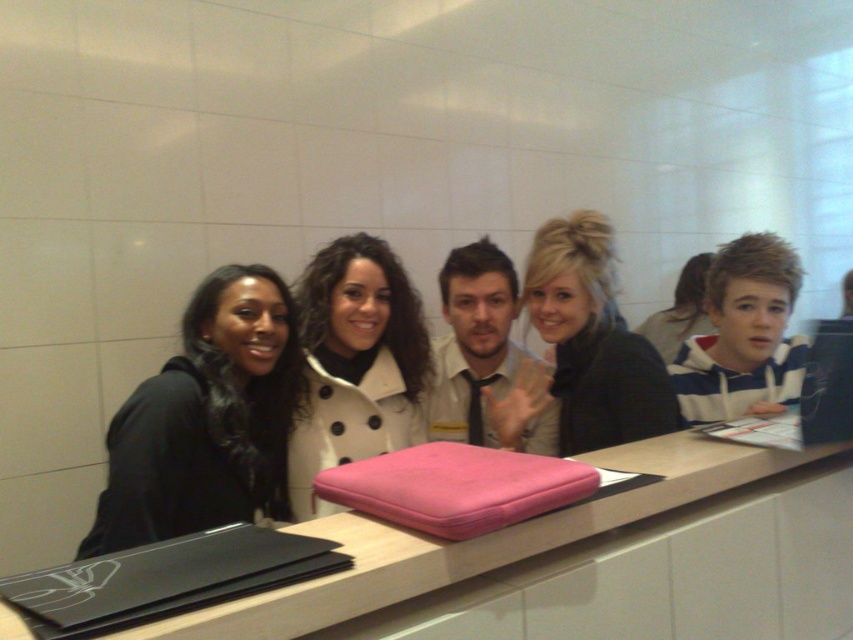
Question: Can you confirm if pink fabric at center is positioned below matte black jacket at center?

Choices:
 (A) no
 (B) yes

Answer: (B)

Question: Considering the relative positions of pink fabric at center and matte black jacket at center in the image provided, where is pink fabric at center located with respect to matte black jacket at center?

Choices:
 (A) left
 (B) right

Answer: (A)

Question: Among these objects, which one is nearest to the camera?

Choices:
 (A) matte black jacket at center
 (B) white plastic laptop at right

Answer: (B)

Question: Can you confirm if black matte jacket at left is bigger than light beige shirt at center?

Choices:
 (A) no
 (B) yes

Answer: (A)

Question: Which point appears closest to the camera in this image?

Choices:
 (A) (440, 276)
 (B) (663, 481)
 (C) (631, 410)
 (D) (318, 424)

Answer: (B)

Question: Which object is farther from the camera taking this photo?

Choices:
 (A) white polka dot coat at center
 (B) pink fabric at center

Answer: (A)